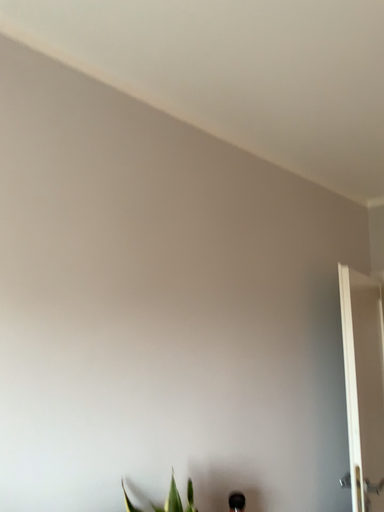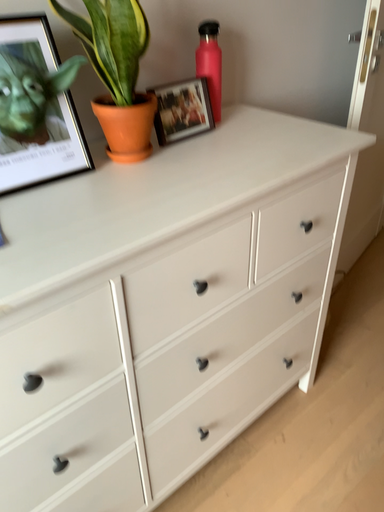
Question: How did the camera likely rotate when shooting the video?

Choices:
 (A) rotated upward
 (B) rotated downward

Answer: (B)